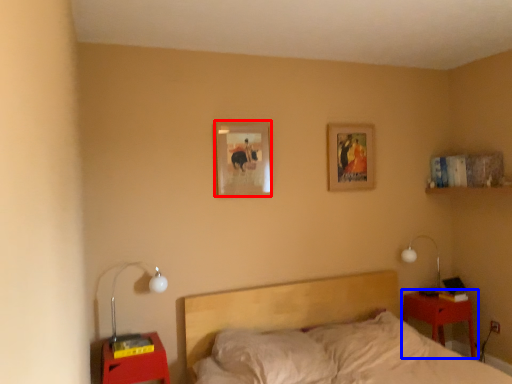
Question: Among these objects, which one is nearest to the camera, picture frame (highlighted by a red box) or nightstand (highlighted by a blue box)?

Choices:
 (A) picture frame
 (B) nightstand

Answer: (A)